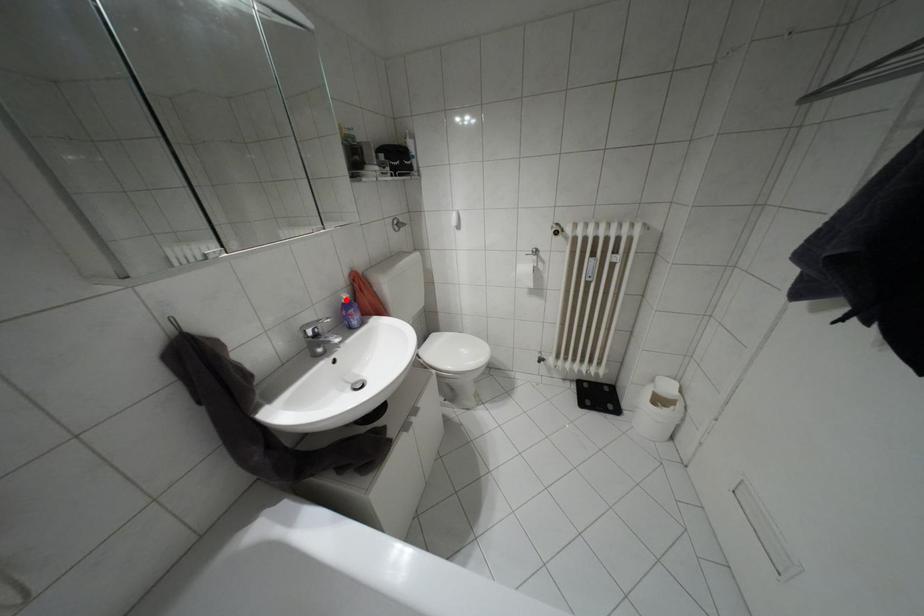
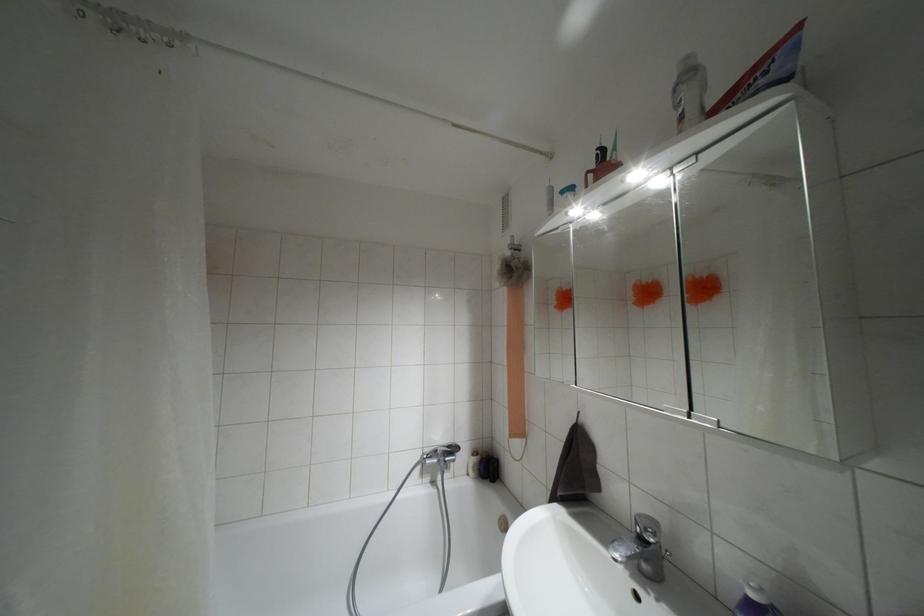
In the second image, find the point that corresponds to the highlighted location in the first image.

(751, 594)